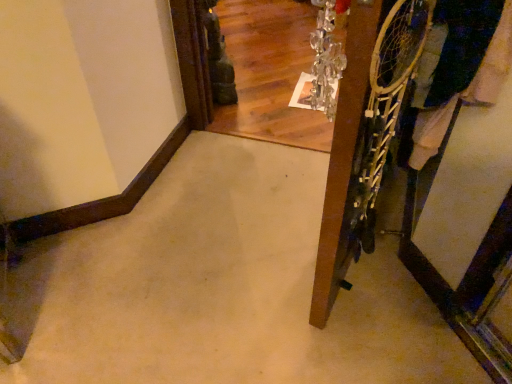
The image size is (512, 384). Describe the element at coordinates (430, 133) in the screenshot. I see `dark blue fabric at right` at that location.

In the scene shown: What is the approximate width of dark blue fabric at right?

dark blue fabric at right is 23.93 centimeters in width.

Locate an element on the screen. The width and height of the screenshot is (512, 384). dark blue fabric at right is located at coordinates (430, 133).

Describe the element at coordinates (364, 134) in the screenshot. I see `wooden door at right` at that location.

You are a GUI agent. You are given a task and a screenshot of the screen. Output one action in this format:
    pyautogui.click(x=<x>, y=<y>)
    Task: Click on the wooden door at right
    This screenshot has width=512, height=384.
    Given the screenshot: What is the action you would take?
    pyautogui.click(x=364, y=134)

This screenshot has width=512, height=384. Identify the location of dark blue fabric at right. (430, 133).

From the picture: Considering the relative positions of dark blue fabric at right and wooden door at right in the image provided, is dark blue fabric at right to the right of wooden door at right from the viewer's perspective?

Correct, you'll find dark blue fabric at right to the right of wooden door at right.

Is dark blue fabric at right positioned behind wooden door at right?

That is True.

Between point (433, 125) and point (358, 192), which one is positioned in front?

The point (358, 192) is in front.

From the image's perspective, does dark blue fabric at right appear higher than wooden door at right?

Yes.

From a real-world perspective, is dark blue fabric at right on wooden door at right?

No, from a real-world perspective, dark blue fabric at right is not on top of wooden door at right.

From the picture: Which of these two, dark blue fabric at right or wooden door at right, is wider?

Wider between the two is dark blue fabric at right.

Can you confirm if dark blue fabric at right is taller than wooden door at right?

Incorrect, the height of dark blue fabric at right is not larger of that of wooden door at right.

Is dark blue fabric at right bigger or smaller than wooden door at right?

Considering their sizes, dark blue fabric at right takes up more space than wooden door at right.

Do you think dark blue fabric at right is within wooden door at right, or outside of it?

dark blue fabric at right cannot be found inside wooden door at right.

Is dark blue fabric at right not close to wooden door at right?

No, dark blue fabric at right is not far away from wooden door at right.

Is dark blue fabric at right aimed at wooden door at right?

No, dark blue fabric at right is not oriented towards wooden door at right.

How much distance is there between dark blue fabric at right and wooden door at right?

8.39 inches.

Find the location of a particular element. Image resolution: width=512 pixels, height=384 pixels. clothing behind the wooden door at right is located at coordinates (430, 133).

Between wooden door at right and dark blue fabric at right, which one appears on the right side from the viewer's perspective?

dark blue fabric at right.

Is wooden door at right in front of or behind dark blue fabric at right in the image?

Visually, wooden door at right is located in front of dark blue fabric at right.

Which is closer to the camera, (380, 35) or (424, 162)?

Point (380, 35) is closer to the camera than point (424, 162).

From the image's perspective, which is above, wooden door at right or dark blue fabric at right?

dark blue fabric at right, from the image's perspective.

From a real-world perspective, relative to dark blue fabric at right, is wooden door at right vertically above or below?

In terms of real-world spatial position, wooden door at right is above dark blue fabric at right.

Between wooden door at right and dark blue fabric at right, which one has larger width?

Wider between the two is dark blue fabric at right.

Is wooden door at right shorter than dark blue fabric at right?

No, wooden door at right is not shorter than dark blue fabric at right.

Is wooden door at right smaller than dark blue fabric at right?

Correct, wooden door at right occupies less space than dark blue fabric at right.

Is wooden door at right not inside dark blue fabric at right?

wooden door at right is positioned outside dark blue fabric at right.

Is wooden door at right far away from dark blue fabric at right?

No, there isn't a large distance between wooden door at right and dark blue fabric at right.

Could you tell me if wooden door at right is facing dark blue fabric at right?

No.

How far apart are wooden door at right and dark blue fabric at right?

They are 8.39 inches apart.

This screenshot has height=384, width=512. I want to click on door above the dark blue fabric at right (from a real-world perspective), so click(x=364, y=134).

Locate an element on the screen. The image size is (512, 384). door in front of the dark blue fabric at right is located at coordinates (364, 134).

I want to click on door above the dark blue fabric at right (from a real-world perspective), so click(364, 134).